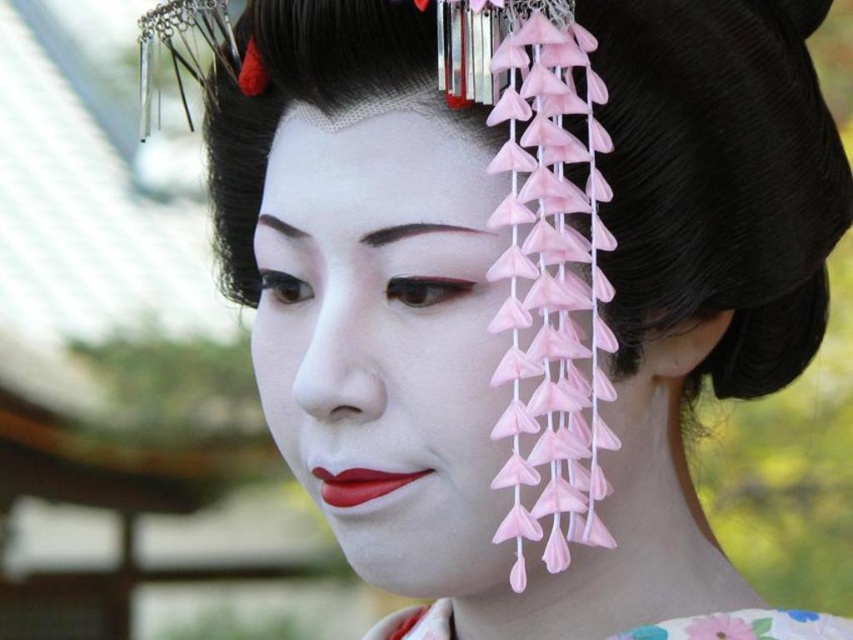
You are a makeup artist observing the traditional Japanese attire scene. You notice the floral silk kimono at lower center and the matte red lipstick at center. Which object is positioned closer to the front of the image?

The floral silk kimono at lower center is positioned closer to the front of the image because the matte red lipstick at center is behind it.

Based on the scene description, where is the matte white face at center located in relation to the point marked at coordinates (415,305)?

The point at coordinates (415,305) indicates the location of the matte white face at center, so they are in the same position.

You are a photographer preparing to take a portrait of the person in the image. Considering the matte white face at center and the floral silk kimono at lower center, which object should you focus on to ensure the subject is highlighted properly?

The matte white face at center should be focused on because it is larger in size compared to the floral silk kimono at lower center, making it the main subject.